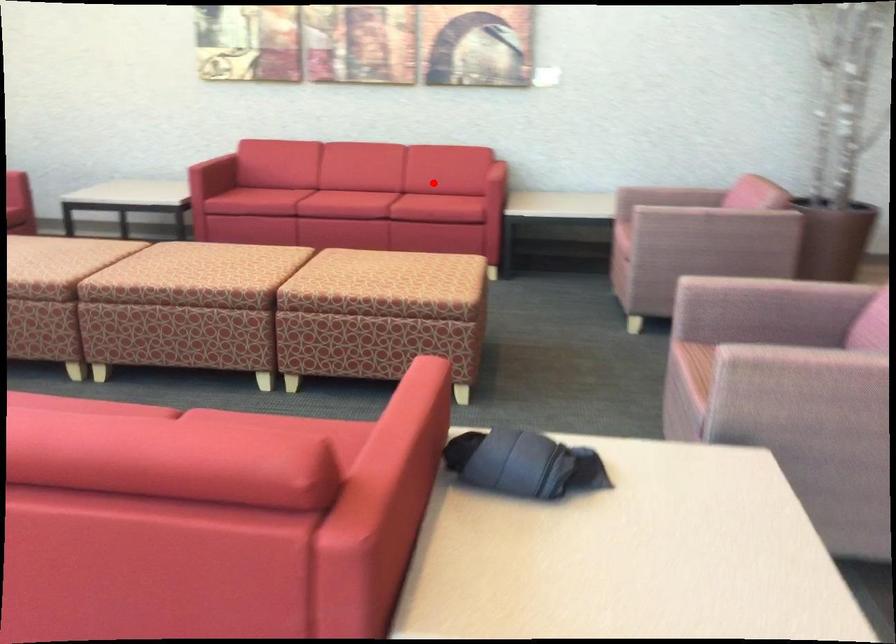
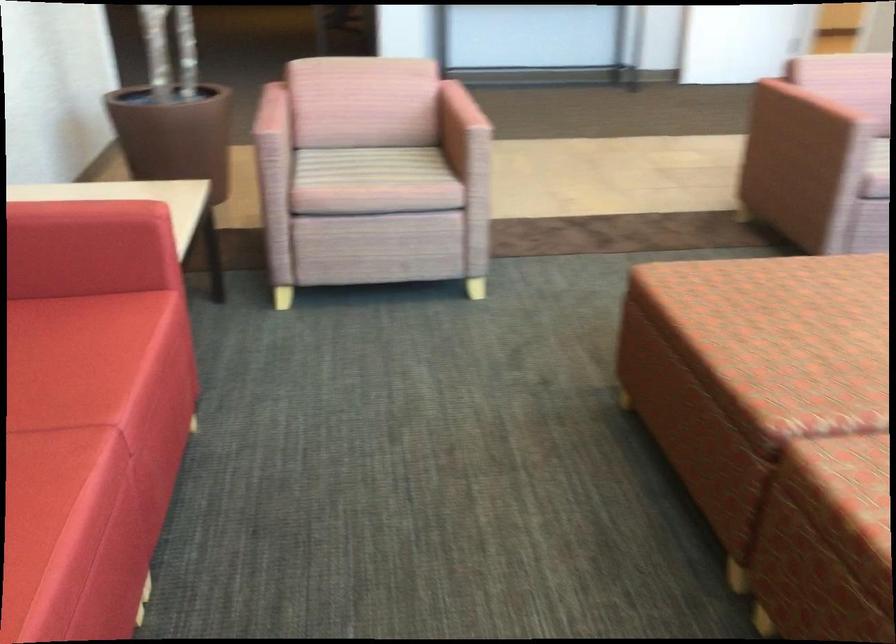
Where in the second image is the point corresponding to the highlighted location from the first image?

(69, 360)